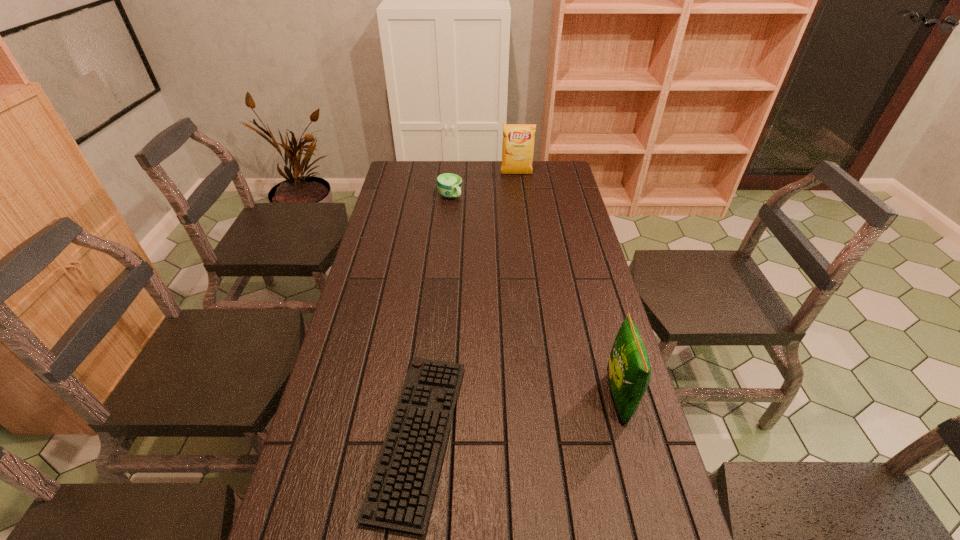
Identify the location of the farther crisp (potato chip). The width and height of the screenshot is (960, 540). (518, 140).

In order to click on the farthest object in this screenshot , I will do `click(518, 140)`.

Identify the location of the right crisp (potato chip). (629, 372).

Image resolution: width=960 pixels, height=540 pixels. In order to click on the rightmost object in this screenshot , I will do `click(629, 372)`.

Find the location of a particular element. Image resolution: width=960 pixels, height=540 pixels. the second farthest object is located at coordinates [448, 185].

I want to click on cup, so click(x=448, y=185).

Locate an element on the screen. This screenshot has width=960, height=540. computer keyboard is located at coordinates (400, 494).

You are a GUI agent. You are given a task and a screenshot of the screen. Output one action in this format:
    pyautogui.click(x=<x>, y=<y>)
    Task: Click on the free point located on the front of the third object from left to right with the logo
    This screenshot has width=960, height=540.
    Given the screenshot: What is the action you would take?
    pyautogui.click(x=523, y=232)

Find the location of a particular element. free space located 0.300m on the front-facing side of the rightmost object is located at coordinates (484, 398).

In order to click on vacant space situated on the front-facing side of the rightmost object in this screenshot , I will do `click(577, 398)`.